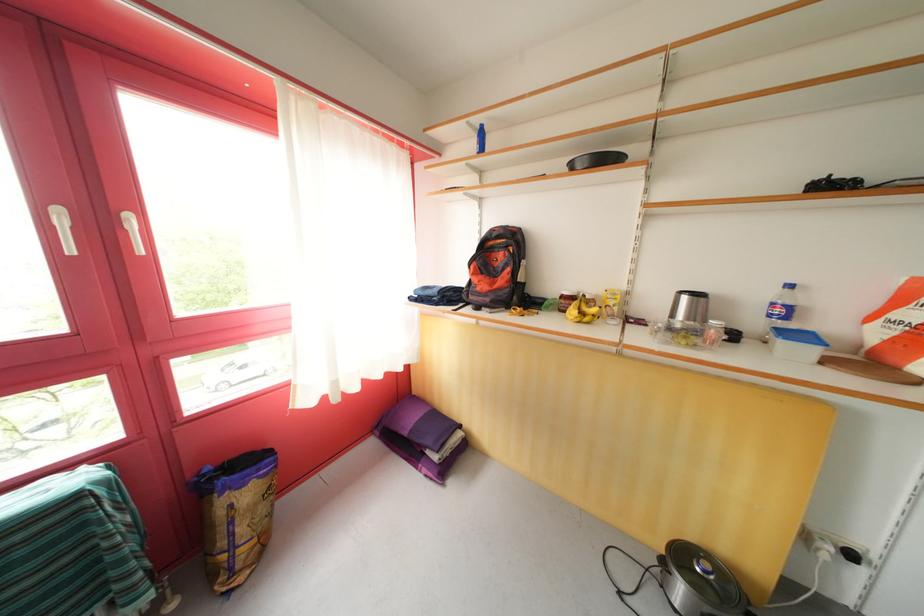
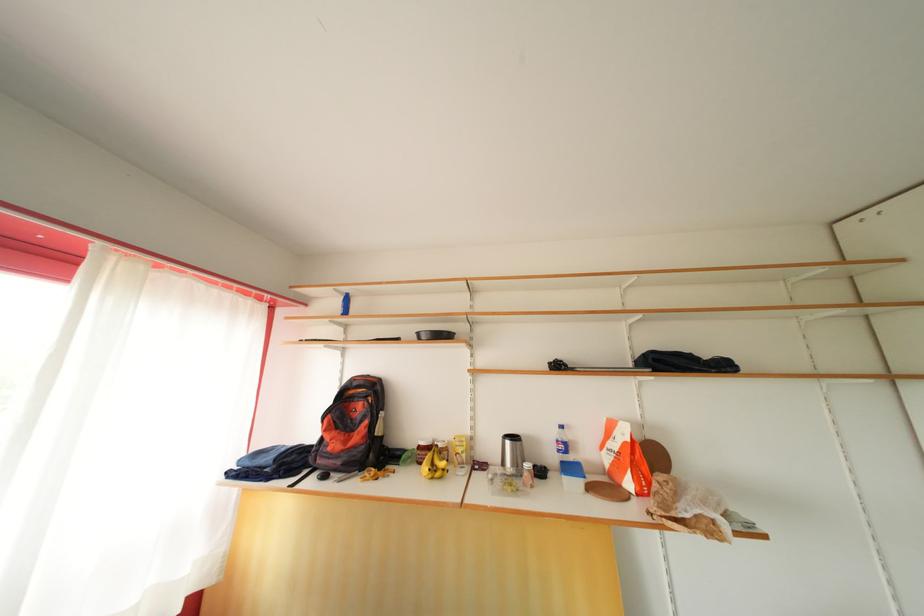
The point at (x=786, y=317) is marked in the first image. Where is the corresponding point in the second image?

(568, 453)